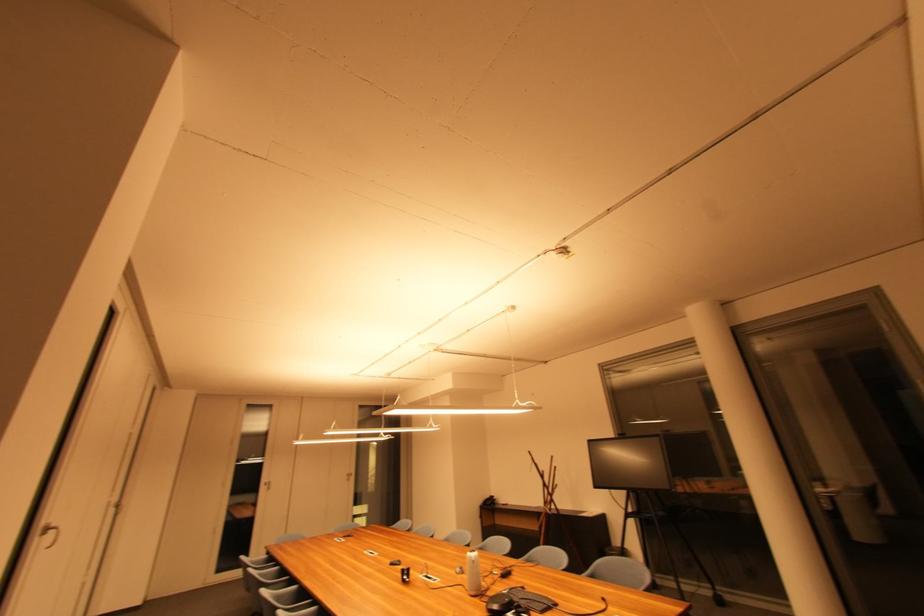
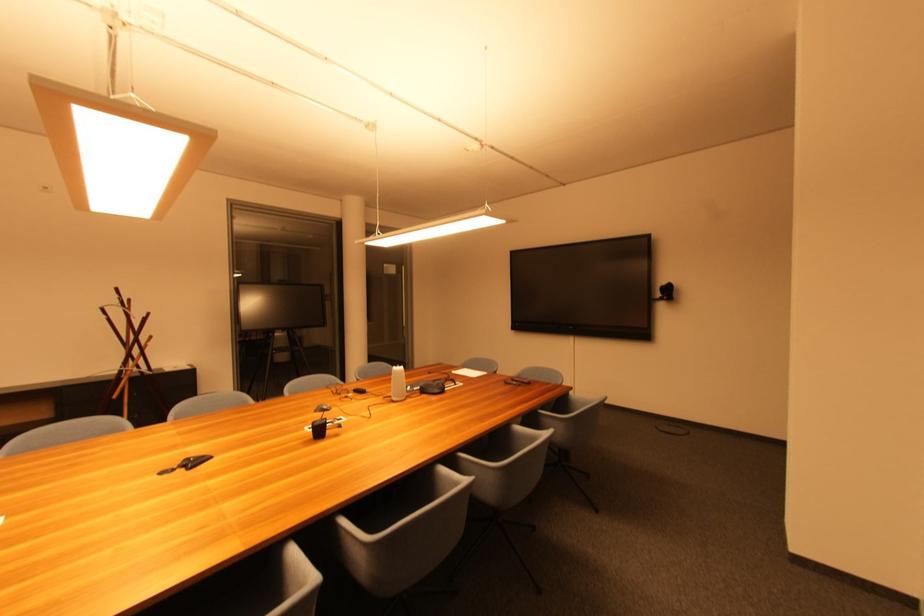
Locate, in the second image, the point that corresponds to point 410,578 in the first image.

(324, 432)